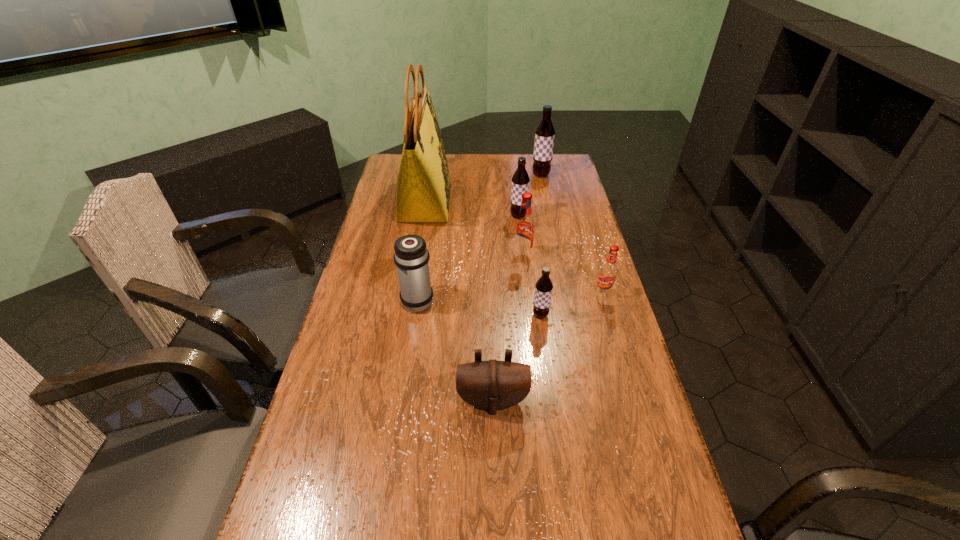
I want to click on vacant area in the image that satisfies the following two spatial constraints: 1. on the front-facing side of the bigger red root beer; 2. on the left side of the yellow tote bag, so tap(417, 255).

This screenshot has width=960, height=540. I want to click on vacant position in the image that satisfies the following two spatial constraints: 1. on the back side of the nearest root beer; 2. on the right side of the nearer red root beer, so click(x=538, y=293).

The image size is (960, 540). Identify the location of free space that satisfies the following two spatial constraints: 1. on the front-facing side of the yellow tote bag; 2. on the right side of the second smallest brown root beer. (423, 216).